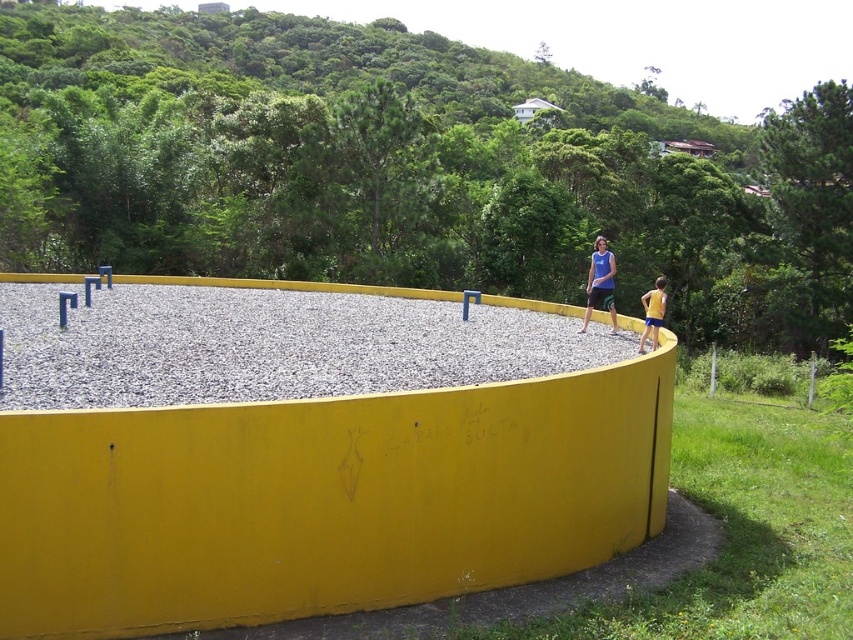
Is the position of blue fabric shirt at center less distant than that of yellow fabric shorts at right?

No, blue fabric shirt at center is behind yellow fabric shorts at right.

Between blue fabric shirt at center and yellow fabric shorts at right, which one is positioned higher?

blue fabric shirt at center is higher up.

You are a GUI agent. You are given a task and a screenshot of the screen. Output one action in this format:
    pyautogui.click(x=<x>, y=<y>)
    Task: Click on the blue fabric shirt at center
    The image size is (853, 640).
    Given the screenshot: What is the action you would take?
    pyautogui.click(x=601, y=284)

Locate an element on the screen. This screenshot has height=640, width=853. blue fabric shirt at center is located at coordinates (601, 284).

Can you confirm if gray gravel at center is positioned to the right of blue fabric shirt at center?

Incorrect, gray gravel at center is not on the right side of blue fabric shirt at center.

Is gray gravel at center positioned behind blue fabric shirt at center?

That is False.

The image size is (853, 640). What do you see at coordinates (270, 346) in the screenshot? I see `gray gravel at center` at bounding box center [270, 346].

Image resolution: width=853 pixels, height=640 pixels. In order to click on gray gravel at center in this screenshot , I will do `click(270, 346)`.

Is yellow painted concrete barrier at center positioned before gray gravel at center?

Yes, yellow painted concrete barrier at center is closer to the viewer.

Which of these two, yellow painted concrete barrier at center or gray gravel at center, stands taller?

Standing taller between the two is yellow painted concrete barrier at center.

Does point (141, 451) come closer to viewer compared to point (44, 378)?

Yes, it is in front of point (44, 378).

Find the location of `yellow painted concrete barrier at center`. yellow painted concrete barrier at center is located at coordinates (323, 499).